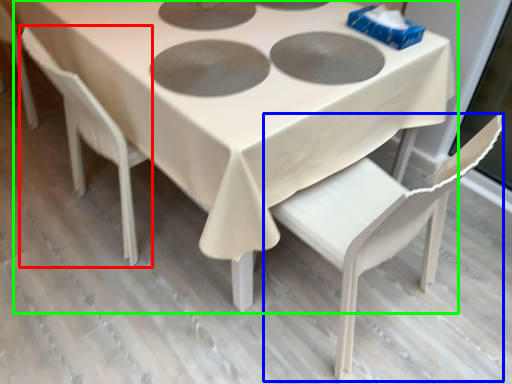
Question: Which object is positioned farthest from chair (highlighted by a red box)? Select from chair (highlighted by a blue box) and table (highlighted by a green box).

Choices:
 (A) chair
 (B) table

Answer: (A)